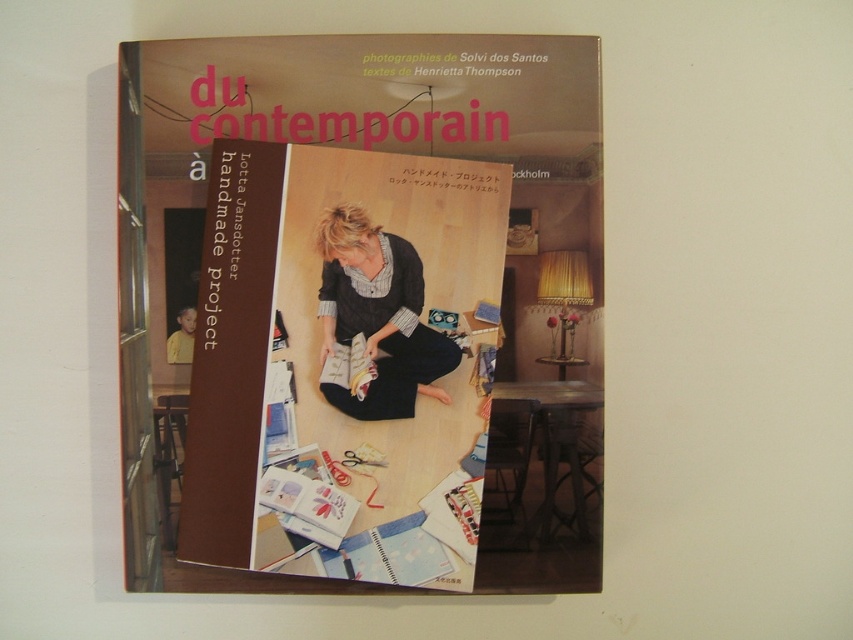
Question: Is the position of matte black book at center less distant than that of matte black dress at center?

Choices:
 (A) no
 (B) yes

Answer: (B)

Question: Does matte black book at center appear under matte black dress at center?

Choices:
 (A) yes
 (B) no

Answer: (A)

Question: Can you confirm if matte black book at center is bigger than matte black dress at center?

Choices:
 (A) no
 (B) yes

Answer: (B)